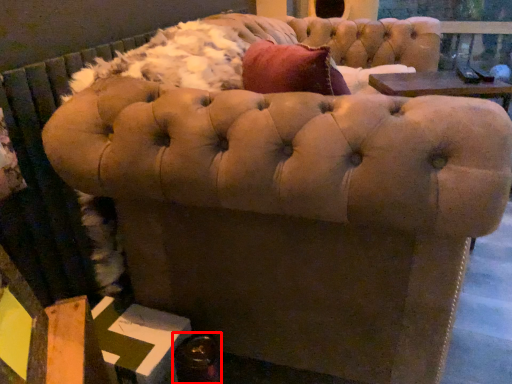
Question: From the image's perspective, where is bottle (annotated by the red box) located relative to furniture?

Choices:
 (A) above
 (B) below

Answer: (B)